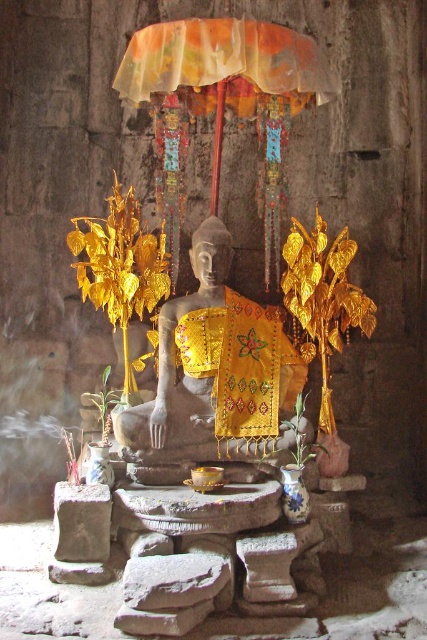
You are a photographer standing in front of the altar and want to take a photo that includes both point (155, 460) and point (304, 65). Which point is closer to the camera?

Point (155, 460) is further to the camera than point (304, 65), so point (304, 65) is closer to the camera.

Based on the photo, you are an archaeologist examining the ancient temple altar. You notice the yellow embroidered cloth at center and the translucent fabric umbrella at upper center. Which object is positioned to the left when viewed from your perspective?

The yellow embroidered cloth at center is to the left of the translucent fabric umbrella at upper center.